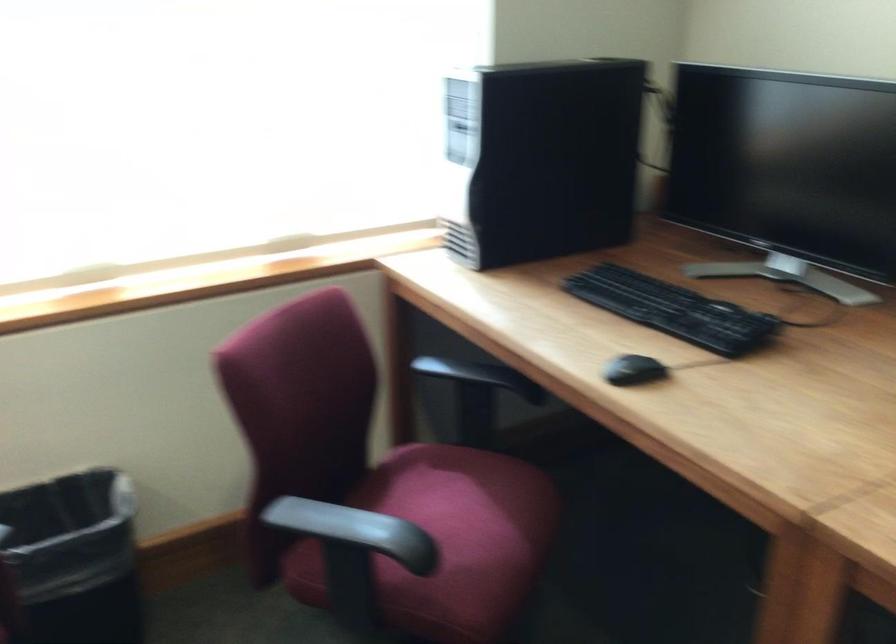
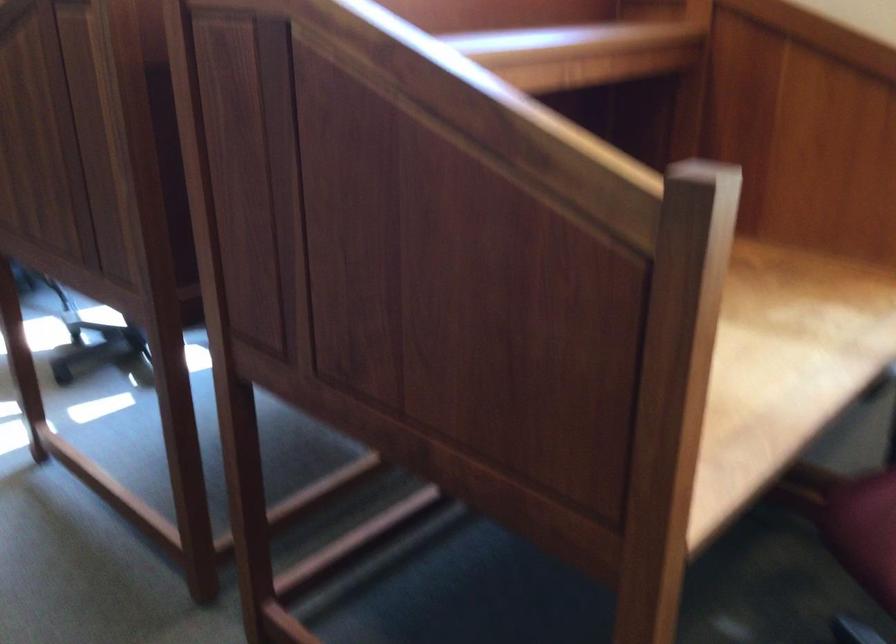
Looking at this image, based on the continuous images, in which direction is the camera rotating?

The rotation direction of the camera is left-down.